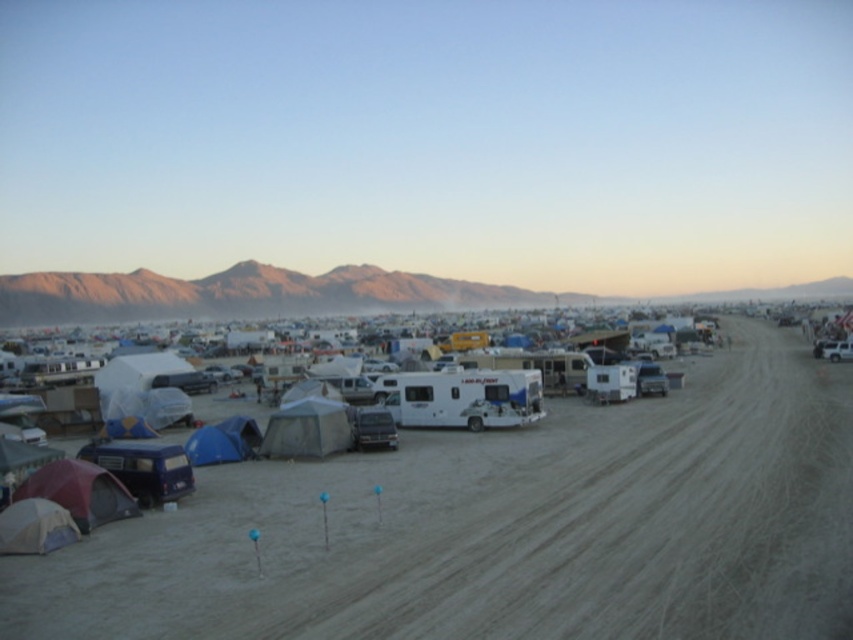
What do you see at coordinates (244, 292) in the screenshot?
I see `golden sandstone mountains at upper center` at bounding box center [244, 292].

Find the location of a particular element. golden sandstone mountains at upper center is located at coordinates (244, 292).

This screenshot has width=853, height=640. Describe the element at coordinates (244, 292) in the screenshot. I see `golden sandstone mountains at upper center` at that location.

Locate an element on the screen. golden sandstone mountains at upper center is located at coordinates point(244,292).

In the scene shown: Does dusty sand dirt field at center have a greater width compared to gray fabric tent at center?

Yes.

Is dusty sand dirt field at center thinner than gray fabric tent at center?

No.

This screenshot has height=640, width=853. Identify the location of dusty sand dirt field at center. (503, 529).

Does blue matte van at lower left come in front of white matte tent at lower left?

No, blue matte van at lower left is further to the viewer.

Who is higher up, blue matte van at lower left or white matte tent at lower left?

white matte tent at lower left

You are a GUI agent. You are given a task and a screenshot of the screen. Output one action in this format:
    pyautogui.click(x=<x>, y=<y>)
    Task: Click on the blue matte van at lower left
    The image size is (853, 640).
    Given the screenshot: What is the action you would take?
    pyautogui.click(x=143, y=467)

Identify the location of blue matte van at lower left. The height and width of the screenshot is (640, 853). (143, 467).